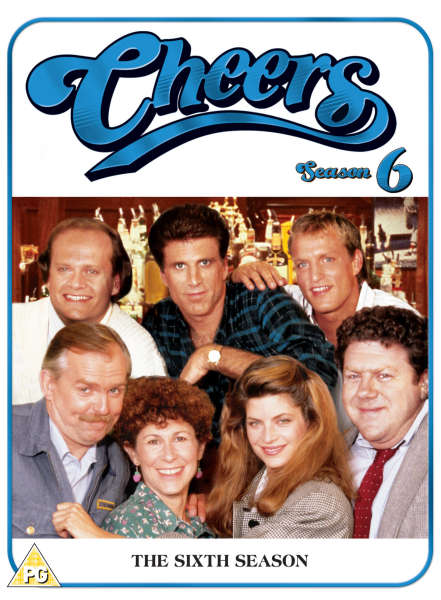
This screenshot has width=441, height=600. Identify the location of wooden wall. (73, 207).